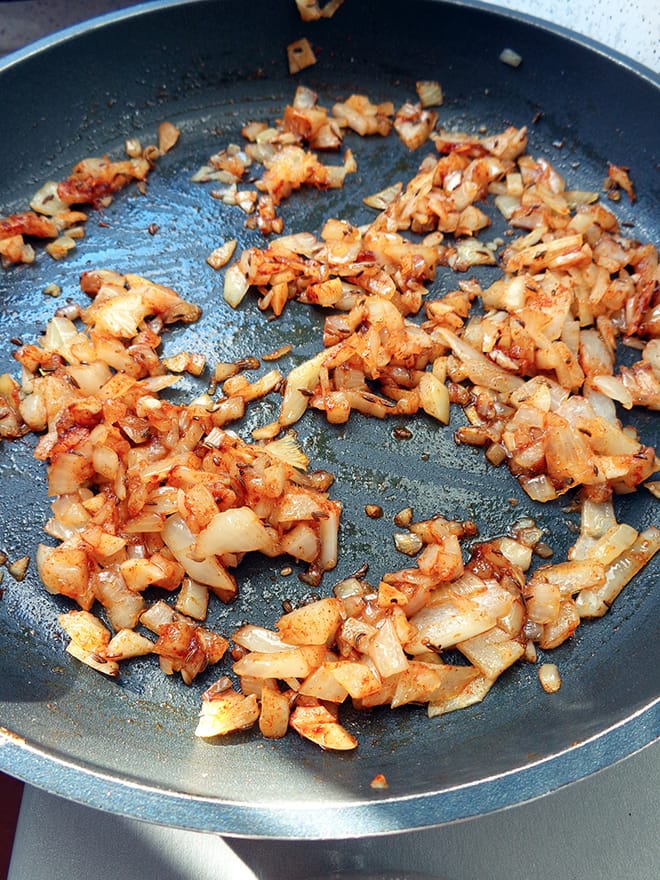
At what (x,y) coordinates should I click in order to perform the action: click on metallic circular pan. Please return your answer as a coordinate pair (x, y). The image size is (660, 880). Looking at the image, I should click on tap(185, 267).